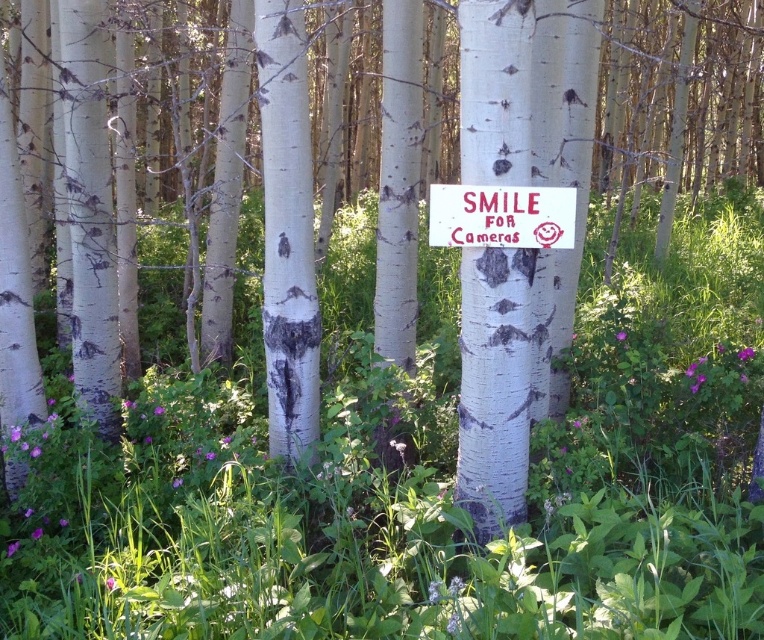
You are a hiker who just arrived at the forest clearing. You see the white bark tree trunk at center and the white painted wood sign at center. Which object is positioned higher up in the image?

The white painted wood sign at center is positioned higher up because the white bark tree trunk at center is located below it.

You are a photographer setting up a tripod in the forest. You need to place your camera so that both the white bark tree trunk at center and the white painted wood sign at center are visible in the frame. Which object should you position closer to the camera to ensure both are in focus?

You should position the white bark tree trunk at center closer to the camera because it is bigger than the white painted wood sign at center, so keeping it closer will help maintain focus on both objects.

Consider the image. You are standing in the forest scene described. There is a point marked at coordinates (500, 378). What object is located at that point?

The point at coordinates (500, 378) is where the white bark tree trunk at center is located.